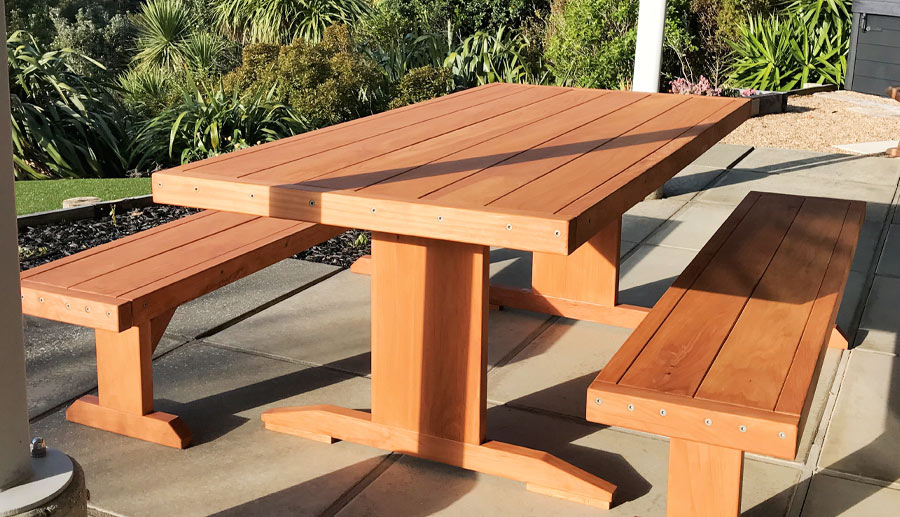
In order to click on right bench in this screenshot , I will do `click(756, 326)`.